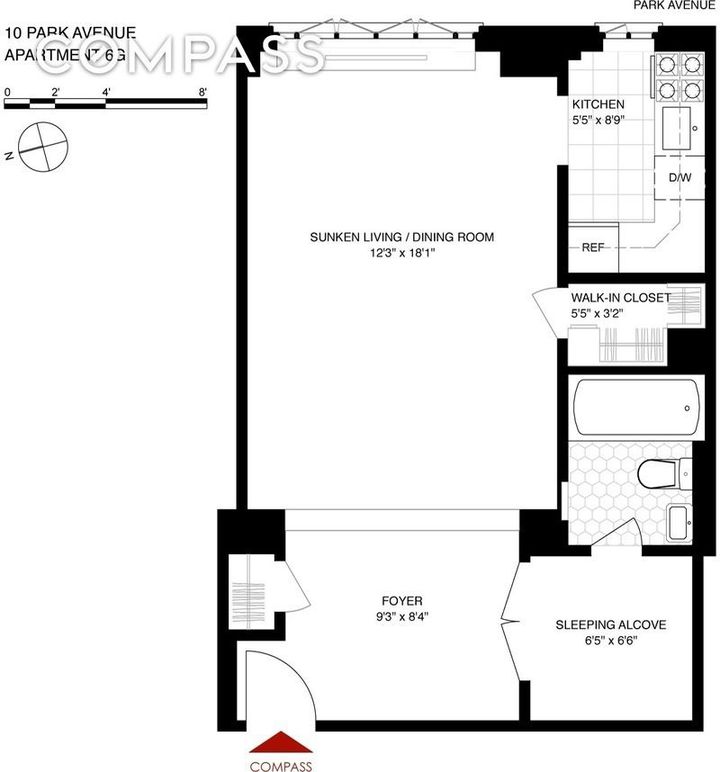
In order to click on "foyer" written in black capital letters in this screenshot , I will do `click(399, 598)`.